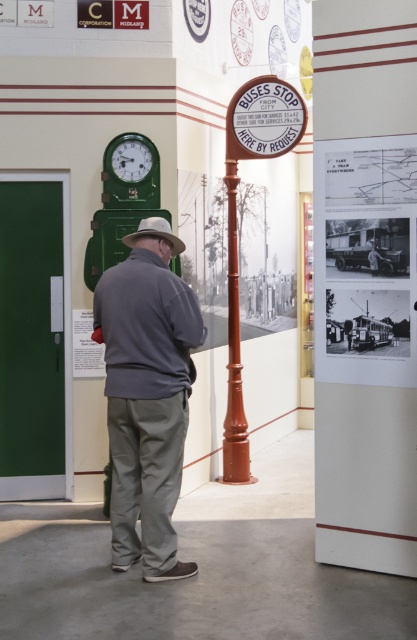
Question: Is smooth brown pole at upper right thinner than light brown felt hat at center?

Choices:
 (A) no
 (B) yes

Answer: (B)

Question: Does black paper at upper right have a lesser width compared to matte green clock at left?

Choices:
 (A) no
 (B) yes

Answer: (A)

Question: Which point appears farthest from the camera in this image?

Choices:
 (A) (248, 452)
 (B) (120, 406)
 (C) (140, 230)
 (D) (369, 342)

Answer: (A)

Question: Estimate the real-world distances between objects in this image. Which object is closer to the gray cotton jacket at center?

Choices:
 (A) smooth brown pole at upper right
 (B) matte green clock at left
 (C) black paper at upper right

Answer: (C)

Question: Is matte green clock at left smaller than light brown felt hat at center?

Choices:
 (A) no
 (B) yes

Answer: (B)

Question: Which object is closer to the camera taking this photo?

Choices:
 (A) gray cotton jacket at center
 (B) matte green clock at left
 (C) light brown felt hat at center
 (D) smooth brown pole at upper right

Answer: (A)